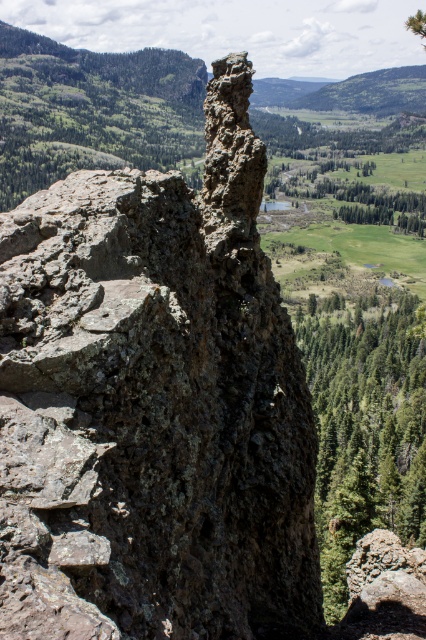
Question: Does rusty stone rock at center appear over green textured tree at right?

Choices:
 (A) no
 (B) yes

Answer: (B)

Question: Which point is farther from the camera taking this photo?

Choices:
 (A) (178, 301)
 (B) (342, 401)

Answer: (B)

Question: Which point is farther from the camera taking this photo?

Choices:
 (A) (250, 296)
 (B) (330, 426)

Answer: (B)

Question: Does rusty stone rock at center have a greater width compared to green textured tree at right?

Choices:
 (A) yes
 (B) no

Answer: (B)

Question: Does rusty stone rock at center have a smaller size compared to green textured tree at right?

Choices:
 (A) yes
 (B) no

Answer: (A)

Question: Which point is farther to the camera?

Choices:
 (A) coord(108,627)
 (B) coord(397,316)

Answer: (B)